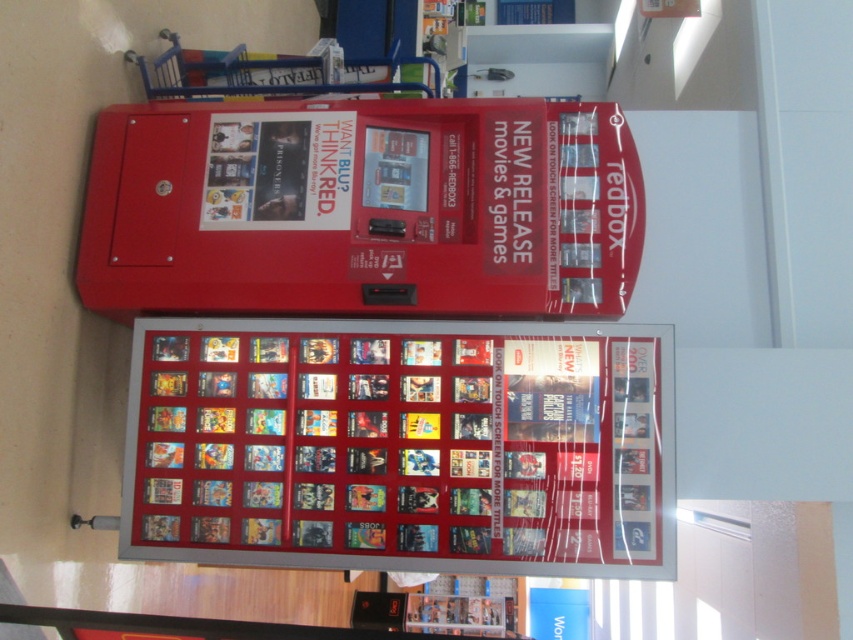
Which is in front, point (416, 552) or point (99, 192)?

Point (416, 552)

Between metallic silver frame at center and metallic red vending machine at center, which one has less height?

metallic red vending machine at center is shorter.

Who is more forward, (421, 371) or (607, 291)?

Point (421, 371) is more forward.

You are a GUI agent. You are given a task and a screenshot of the screen. Output one action in this format:
    pyautogui.click(x=<x>, y=<y>)
    Task: Click on the metallic silver frame at center
    The height and width of the screenshot is (640, 853).
    Given the screenshot: What is the action you would take?
    pyautogui.click(x=402, y=445)